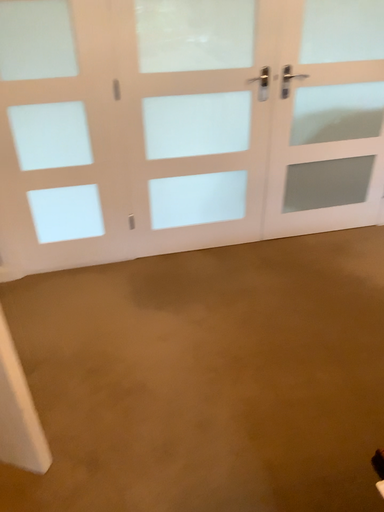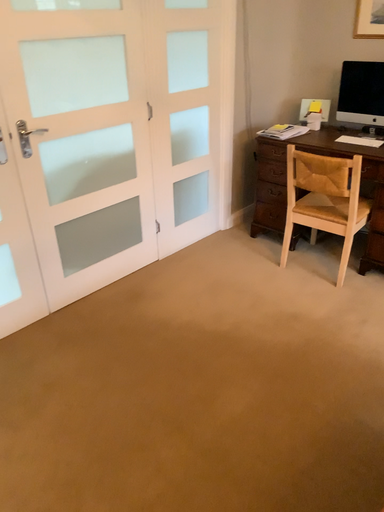
Question: Which way did the camera rotate in the video?

Choices:
 (A) rotated downward
 (B) rotated upward

Answer: (B)